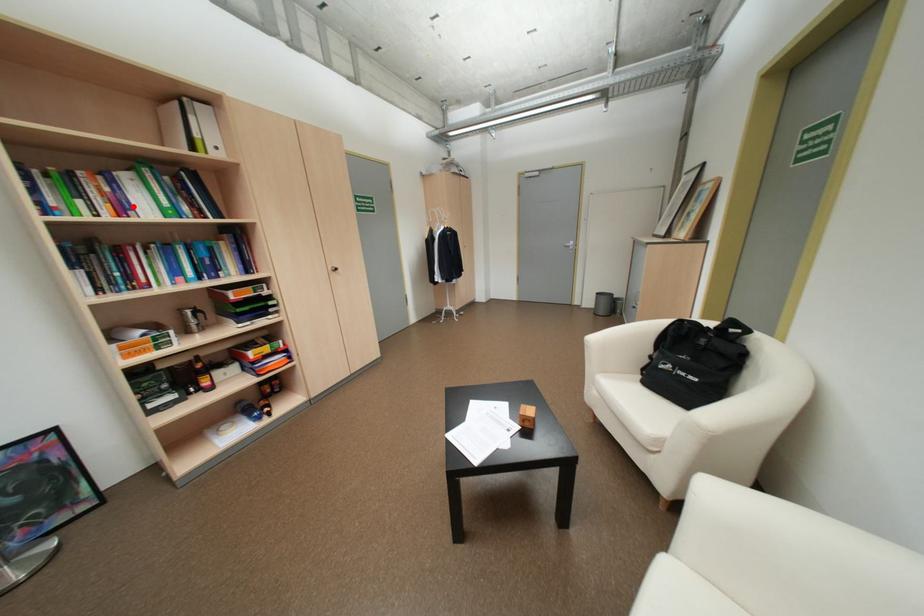
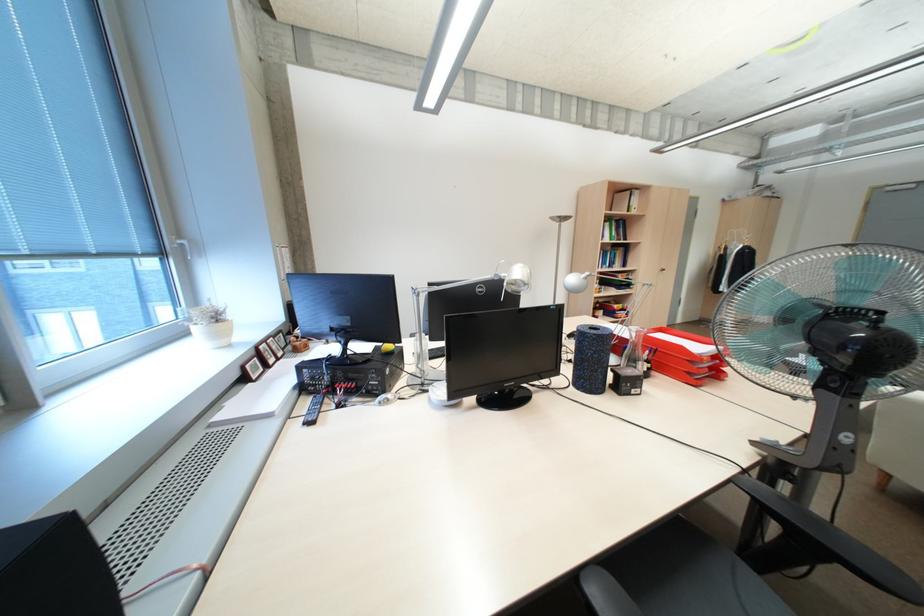
The point at the highlighted location is marked in the first image. Where is the corresponding point in the second image?

(612, 236)